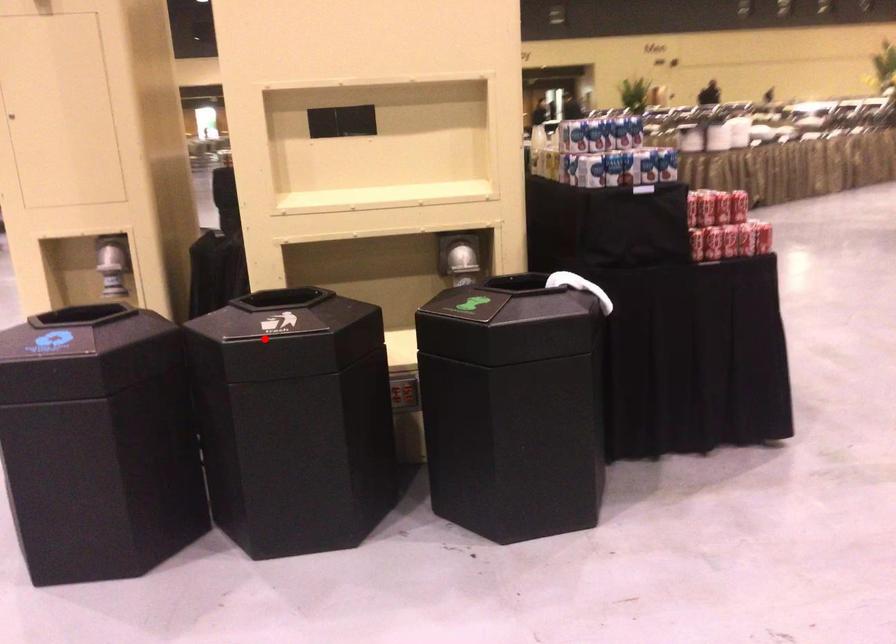
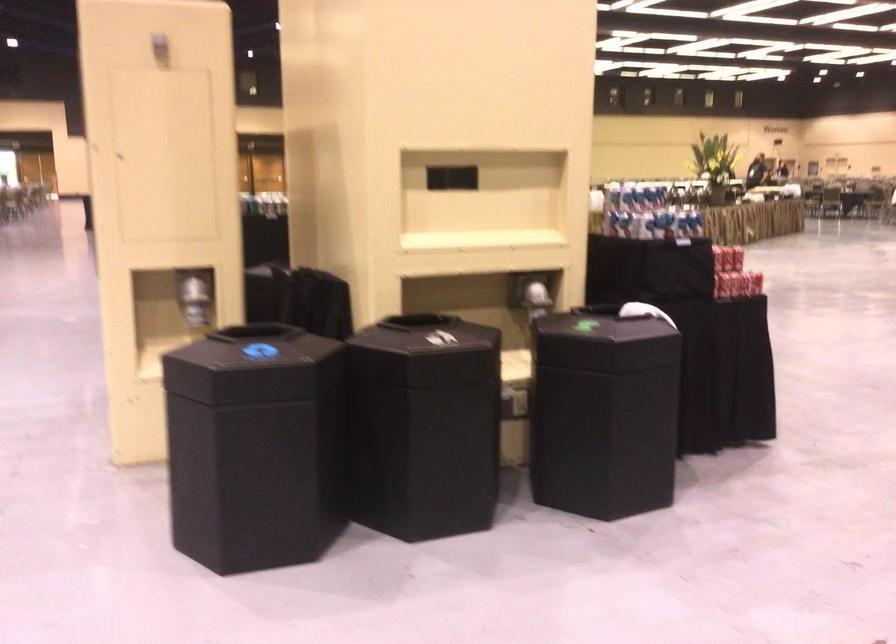
Question: A red point is marked in image1. In image2, is the corresponding 3D point closer to the camera or farther? Reply with the corresponding letter.

Choices:
 (A) The corresponding 3D point is closer.
 (B) The corresponding 3D point is farther.

Answer: (B)